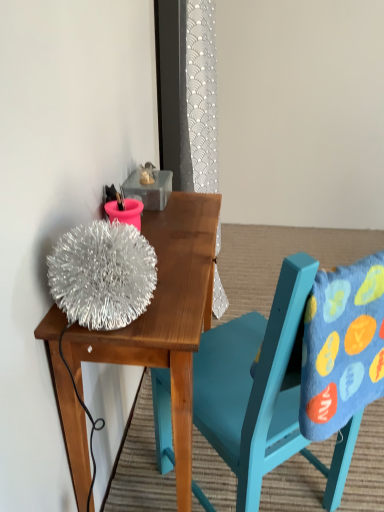
This screenshot has height=512, width=384. I want to click on shiny metallic ball at upper left, so click(166, 316).

What is the approximate width of teal painted wood chair at upper center?

The width of teal painted wood chair at upper center is 20.62 inches.

Describe the element at coordinates (262, 392) in the screenshot. Image resolution: width=384 pixels, height=512 pixels. I see `teal painted wood chair at upper center` at that location.

Find the location of a particular element. The image size is (384, 512). shiny metallic ball at upper left is located at coordinates (166, 316).

Which object is positioned more to the left, teal painted wood chair at upper center or blue felt pillow at right?

teal painted wood chair at upper center.

Could you tell me if teal painted wood chair at upper center is turned towards blue felt pillow at right?

No, teal painted wood chair at upper center is not aimed at blue felt pillow at right.

Looking at the image, does teal painted wood chair at upper center seem bigger or smaller compared to blue felt pillow at right?

Considering their sizes, teal painted wood chair at upper center takes up more space than blue felt pillow at right.

Could you tell me if teal painted wood chair at upper center is turned towards shiny metallic ball at upper left?

Yes, teal painted wood chair at upper center faces towards shiny metallic ball at upper left.

Which is less distant, (283,402) or (113,358)?

The point (113,358) is closer to the camera.

Is teal painted wood chair at upper center not within shiny metallic ball at upper left?

teal painted wood chair at upper center lies outside shiny metallic ball at upper left's area.

Which is more to the left, teal painted wood chair at upper center or shiny metallic ball at upper left?

shiny metallic ball at upper left.

Is shiny metallic ball at upper left directly adjacent to blue felt pillow at right?

shiny metallic ball at upper left is not next to blue felt pillow at right, and they're not touching.

Locate an element on the screen. The image size is (384, 512). pillow located in front of the shiny metallic ball at upper left is located at coordinates (340, 346).

Is shiny metallic ball at upper left closer to camera compared to blue felt pillow at right?

That is False.

Between shiny metallic ball at upper left and blue felt pillow at right, which one appears on the right side from the viewer's perspective?

Positioned to the right is blue felt pillow at right.

Which of these two, blue felt pillow at right or teal painted wood chair at upper center, is smaller?

Smaller between the two is blue felt pillow at right.

Would you say blue felt pillow at right is inside or outside teal painted wood chair at upper center?

blue felt pillow at right is spatially positioned inside teal painted wood chair at upper center.

Is blue felt pillow at right to the left or to the right of teal painted wood chair at upper center in the image?

blue felt pillow at right is to the right of teal painted wood chair at upper center.

From the image's perspective, would you say blue felt pillow at right is positioned over teal painted wood chair at upper center?

Yes, from the image's perspective, blue felt pillow at right is above teal painted wood chair at upper center.

From a real-world perspective, does shiny metallic ball at upper left sit lower than teal painted wood chair at upper center?

Yes.

Considering the relative positions of shiny metallic ball at upper left and teal painted wood chair at upper center in the image provided, is shiny metallic ball at upper left to the left or to the right of teal painted wood chair at upper center?

Clearly, shiny metallic ball at upper left is on the left of teal painted wood chair at upper center in the image.

Does shiny metallic ball at upper left have a greater height compared to teal painted wood chair at upper center?

No, shiny metallic ball at upper left is not taller than teal painted wood chair at upper center.

Is shiny metallic ball at upper left oriented away from teal painted wood chair at upper center?

Yes.

Is blue felt pillow at right with shiny metallic ball at upper left?

They are not placed beside each other.

In the image, is blue felt pillow at right on the left side or the right side of shiny metallic ball at upper left?

Based on their positions, blue felt pillow at right is located to the right of shiny metallic ball at upper left.

Does point (351, 294) come closer to viewer compared to point (75, 413)?

Yes, point (351, 294) is in front of point (75, 413).

Is blue felt pillow at right located outside shiny metallic ball at upper left?

Yes, blue felt pillow at right is located beyond the bounds of shiny metallic ball at upper left.

Where is `chair on the left side of blue felt pillow at right`? chair on the left side of blue felt pillow at right is located at coordinates (262, 392).

Image resolution: width=384 pixels, height=512 pixels. I want to click on desk behind the teal painted wood chair at upper center, so [x=166, y=316].

Considering their positions, is teal painted wood chair at upper center positioned further to shiny metallic ball at upper left than blue felt pillow at right?

blue felt pillow at right lies further to shiny metallic ball at upper left than the other object.

Looking at the image, which one is located further to teal painted wood chair at upper center, shiny metallic ball at upper left or blue felt pillow at right?

shiny metallic ball at upper left is positioned further to the anchor teal painted wood chair at upper center.

Which object lies nearer to the anchor point shiny metallic ball at upper left, blue felt pillow at right or teal painted wood chair at upper center?

Among the two, teal painted wood chair at upper center is located nearer to shiny metallic ball at upper left.

Considering their positions, is shiny metallic ball at upper left positioned closer to blue felt pillow at right than teal painted wood chair at upper center?

teal painted wood chair at upper center is positioned closer to the anchor blue felt pillow at right.

Considering their positions, is blue felt pillow at right positioned further to teal painted wood chair at upper center than shiny metallic ball at upper left?

shiny metallic ball at upper left.

Considering their positions, is teal painted wood chair at upper center positioned further to blue felt pillow at right than shiny metallic ball at upper left?

Based on the image, shiny metallic ball at upper left appears to be further to blue felt pillow at right.

The image size is (384, 512). I want to click on chair located between shiny metallic ball at upper left and blue felt pillow at right in the left-right direction, so click(x=262, y=392).